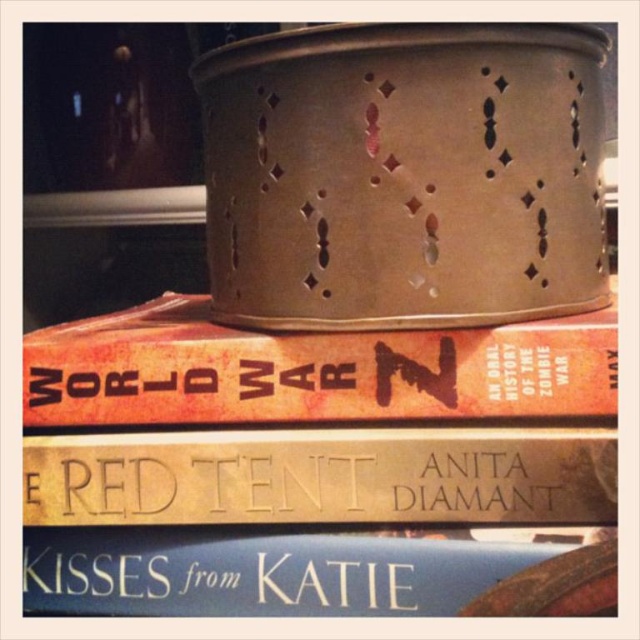
Question: Considering the relative positions of orange matte hardcover book at center and gold embossed book at center in the image provided, where is orange matte hardcover book at center located with respect to gold embossed book at center?

Choices:
 (A) above
 (B) below

Answer: (A)

Question: Which point appears farthest from the camera in this image?

Choices:
 (A) pyautogui.click(x=33, y=600)
 (B) pyautogui.click(x=116, y=445)
 (C) pyautogui.click(x=141, y=417)

Answer: (A)

Question: Does orange matte hardcover book at center appear over blue matte book at lower center?

Choices:
 (A) no
 (B) yes

Answer: (B)

Question: Which object appears farthest from the camera in this image?

Choices:
 (A) blue matte book at lower center
 (B) orange matte hardcover book at center

Answer: (B)

Question: Is orange matte hardcover book at center thinner than blue matte book at lower center?

Choices:
 (A) yes
 (B) no

Answer: (B)

Question: Among these objects, which one is farthest from the camera?

Choices:
 (A) gold embossed book at center
 (B) blue matte book at lower center
 (C) orange matte hardcover book at center

Answer: (C)